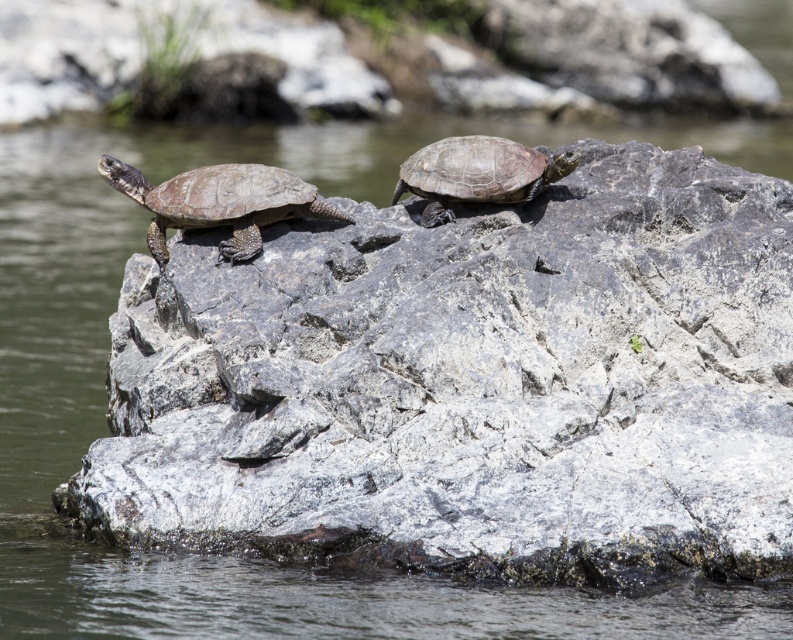
Question: Can you confirm if matte brown tortoise at left is positioned to the left of matte brown tortoise at center?

Choices:
 (A) no
 (B) yes

Answer: (B)

Question: Is matte brown tortoise at left positioned before matte brown tortoise at center?

Choices:
 (A) yes
 (B) no

Answer: (A)

Question: Among these objects, which one is farthest from the camera?

Choices:
 (A) matte brown tortoise at left
 (B) matte brown tortoise at center

Answer: (B)

Question: Which object appears closest to the camera in this image?

Choices:
 (A) matte brown tortoise at left
 (B) matte brown tortoise at center

Answer: (A)

Question: Does matte brown tortoise at left have a greater width compared to matte brown tortoise at center?

Choices:
 (A) no
 (B) yes

Answer: (B)